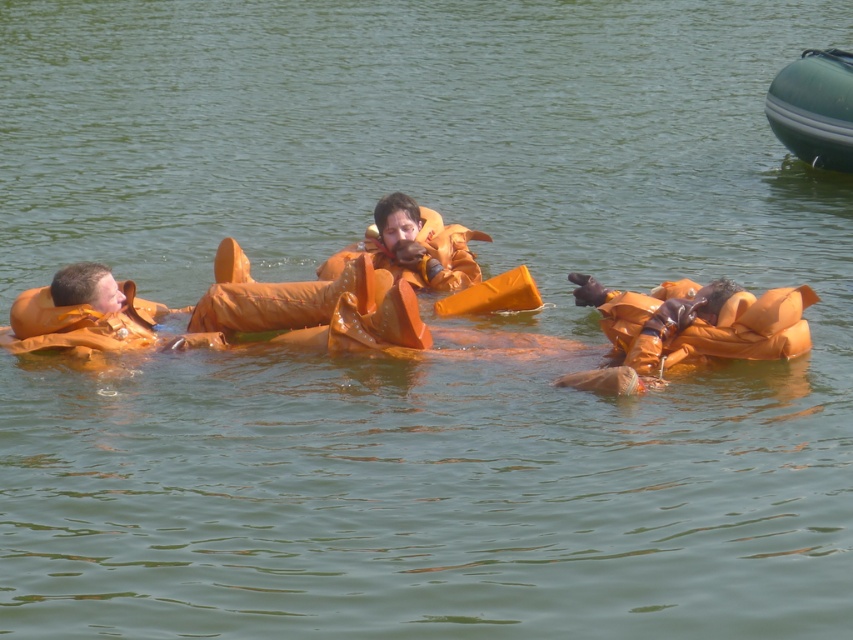
Question: Does orange matte life jacket at center have a smaller size compared to orange rubber life vest at center?

Choices:
 (A) yes
 (B) no

Answer: (A)

Question: Does green rubber boat at upper right appear on the right side of orange matte life jacket at left?

Choices:
 (A) yes
 (B) no

Answer: (A)

Question: Considering the real-world distances, which object is farthest from the orange rubber life vest at center?

Choices:
 (A) orange matte life vest at lower right
 (B) orange matte life jacket at left
 (C) green rubber boat at upper right
 (D) orange matte life jacket at center

Answer: (C)

Question: Which of the following is the farthest from the observer?

Choices:
 (A) (683, 356)
 (B) (142, 323)
 (C) (703, 310)
 (D) (782, 81)

Answer: (D)

Question: Does orange matte life jacket at center appear on the left side of green rubber boat at upper right?

Choices:
 (A) no
 (B) yes

Answer: (B)

Question: Among these objects, which one is farthest from the camera?

Choices:
 (A) orange matte life jacket at center
 (B) green rubber boat at upper right
 (C) orange matte life vest at lower right
 (D) orange rubber life vest at center

Answer: (B)